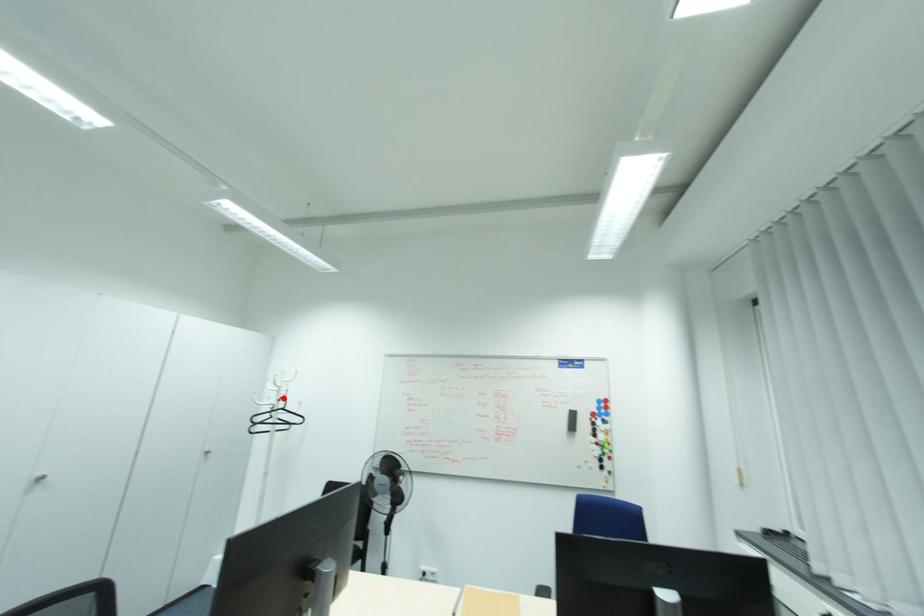
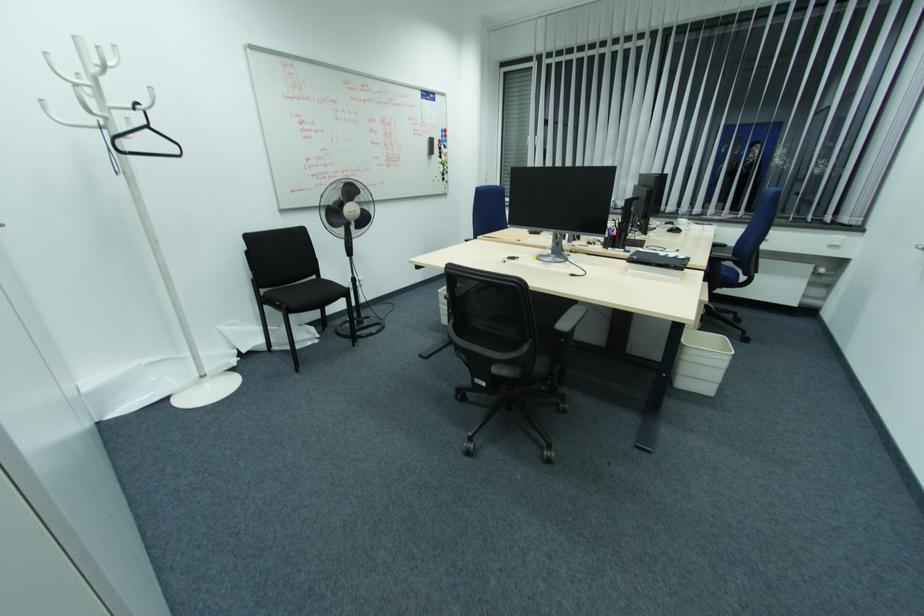
Question: I am providing you with two images of the same scene from different viewpoints. A red point is marked on the first image. Can you still see the location of the red point in image 2?

Choices:
 (A) Yes
 (B) No

Answer: (A)